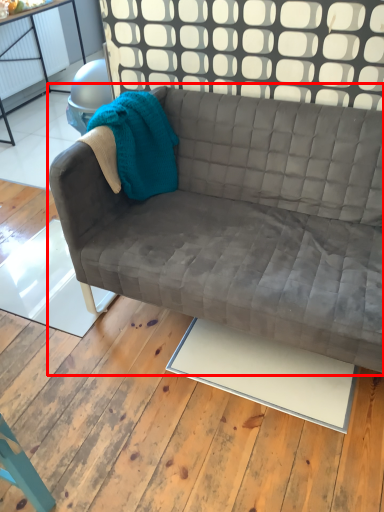
Question: Considering the relative positions of studio couch (annotated by the red box) and plywood in the image provided, where is studio couch (annotated by the red box) located with respect to the staircase?

Choices:
 (A) right
 (B) left

Answer: (A)